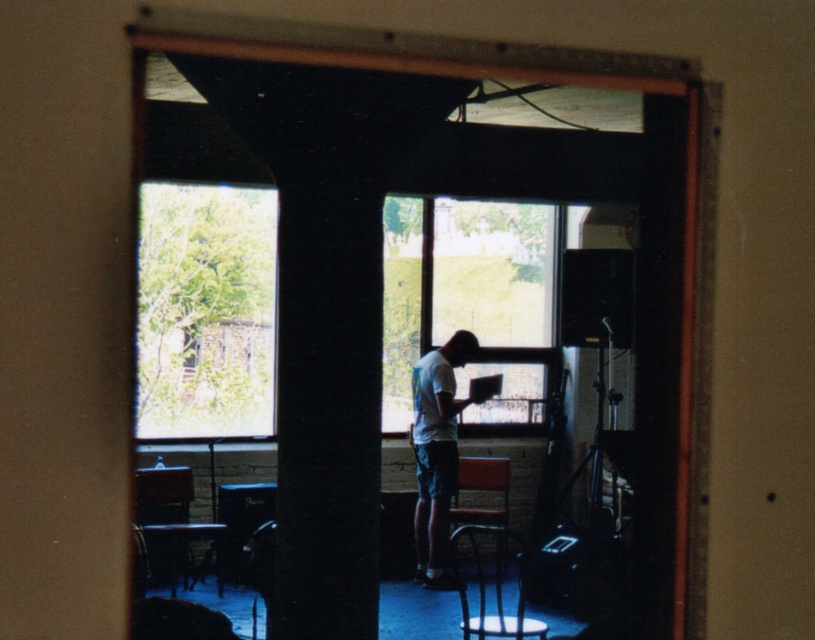
Question: Can you confirm if green leafy tree at upper left is smaller than wooden chair at lower center?

Choices:
 (A) no
 (B) yes

Answer: (B)

Question: Can you confirm if white cotton shirt at center is wider than wooden chair at lower center?

Choices:
 (A) yes
 (B) no

Answer: (B)

Question: Which of the following is the farthest from the observer?

Choices:
 (A) green leafy tree at upper left
 (B) wooden chair at lower center
 (C) wooden chair at center
 (D) white cotton shirt at center

Answer: (A)

Question: Which point appears farthest from the camera in this image?

Choices:
 (A) (181, 216)
 (B) (498, 209)

Answer: (B)

Question: Can you confirm if white cotton shirt at center is bigger than wooden chair at lower center?

Choices:
 (A) yes
 (B) no

Answer: (B)

Question: Which object is positioned farthest from the wooden chair at center?

Choices:
 (A) transparent glass door at center
 (B) green leafy tree at upper left
 (C) transparent glass window at center

Answer: (B)